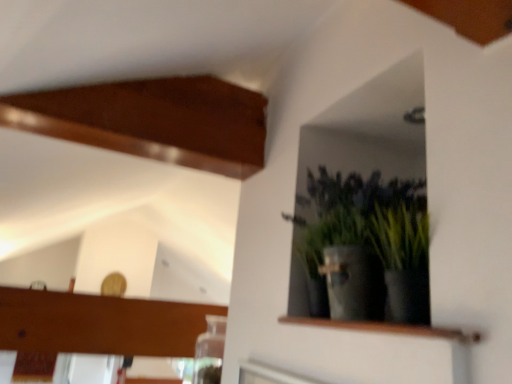
What do you see at coordinates (386, 328) in the screenshot?
I see `wooden shelf at upper right` at bounding box center [386, 328].

Find the location of `wooden shelf at upper right`. wooden shelf at upper right is located at coordinates (386, 328).

What do you see at coordinates (366, 248) in the screenshot? Image resolution: width=512 pixels, height=384 pixels. I see `green matte plant at upper right` at bounding box center [366, 248].

Image resolution: width=512 pixels, height=384 pixels. Identify the location of green matte plant at upper right. (366, 248).

I want to click on wooden shelf at upper right, so click(386, 328).

Which object is positioned more to the right, wooden shelf at upper right or green matte plant at upper right?

From the viewer's perspective, green matte plant at upper right appears more on the right side.

Is the depth of wooden shelf at upper right less than that of green matte plant at upper right?

Yes, wooden shelf at upper right is closer to the camera.

Which point is more distant from viewer, (362, 328) or (341, 175)?

The point (341, 175) is more distant.

From the image's perspective, is wooden shelf at upper right located beneath green matte plant at upper right?

Correct, wooden shelf at upper right appears lower than green matte plant at upper right in the image.

From a real-world perspective, between wooden shelf at upper right and green matte plant at upper right, who is vertically higher?

From a 3D spatial view, green matte plant at upper right is above.

Which object is wider, wooden shelf at upper right or green matte plant at upper right?

Wider between the two is green matte plant at upper right.

Is wooden shelf at upper right shorter than green matte plant at upper right?

Indeed, wooden shelf at upper right has a lesser height compared to green matte plant at upper right.

Considering the relative sizes of wooden shelf at upper right and green matte plant at upper right in the image provided, is wooden shelf at upper right bigger than green matte plant at upper right?

Incorrect, wooden shelf at upper right is not larger than green matte plant at upper right.

Is wooden shelf at upper right completely or partially outside of green matte plant at upper right?

Yes, wooden shelf at upper right is located beyond the bounds of green matte plant at upper right.

Is there a large distance between wooden shelf at upper right and green matte plant at upper right?

No.

Could you tell me if wooden shelf at upper right is facing green matte plant at upper right?

No.

How different are the orientations of wooden shelf at upper right and green matte plant at upper right in degrees?

1.88 degrees.

Measure the distance from wooden shelf at upper right to green matte plant at upper right.

They are 4.98 inches apart.

Find the location of a particular element. houseplant behind the wooden shelf at upper right is located at coordinates (366, 248).

Considering the positions of objects green matte plant at upper right and wooden shelf at upper right in the image provided, who is more to the left, green matte plant at upper right or wooden shelf at upper right?

wooden shelf at upper right is more to the left.

Considering the positions of objects green matte plant at upper right and wooden shelf at upper right in the image provided, who is behind, green matte plant at upper right or wooden shelf at upper right?

green matte plant at upper right is behind.

Considering the points (406, 215) and (289, 319), which point is in front, point (406, 215) or point (289, 319)?

The point (406, 215) is closer.

From the image's perspective, between green matte plant at upper right and wooden shelf at upper right, which one is located above?

green matte plant at upper right, from the image's perspective.

From a real-world perspective, between green matte plant at upper right and wooden shelf at upper right, who is vertically higher?

green matte plant at upper right.

Does green matte plant at upper right have a greater width compared to wooden shelf at upper right?

Correct, the width of green matte plant at upper right exceeds that of wooden shelf at upper right.

Does green matte plant at upper right have a greater height compared to wooden shelf at upper right?

Correct, green matte plant at upper right is much taller as wooden shelf at upper right.

Does green matte plant at upper right have a smaller size compared to wooden shelf at upper right?

Actually, green matte plant at upper right might be larger than wooden shelf at upper right.

Is wooden shelf at upper right located within green matte plant at upper right?

No, wooden shelf at upper right is located outside of green matte plant at upper right.

Looking at this image, would you say green matte plant at upper right is a long distance from wooden shelf at upper right?

That's not correct — green matte plant at upper right is a little close to wooden shelf at upper right.

Is green matte plant at upper right looking in the opposite direction of wooden shelf at upper right?

No, green matte plant at upper right is not facing away from wooden shelf at upper right.

Measure the distance between green matte plant at upper right and wooden shelf at upper right.

green matte plant at upper right is 4.98 inches away from wooden shelf at upper right.

Locate an element on the screen. houseplant above the wooden shelf at upper right (from the image's perspective) is located at coordinates (366, 248).

The height and width of the screenshot is (384, 512). There is a wooden shelf at upper right. In order to click on houseplant above it (from a real-world perspective) in this screenshot , I will do `click(366, 248)`.

Where is `shelf below the green matte plant at upper right (from the image's perspective)`? Image resolution: width=512 pixels, height=384 pixels. shelf below the green matte plant at upper right (from the image's perspective) is located at coordinates (386, 328).